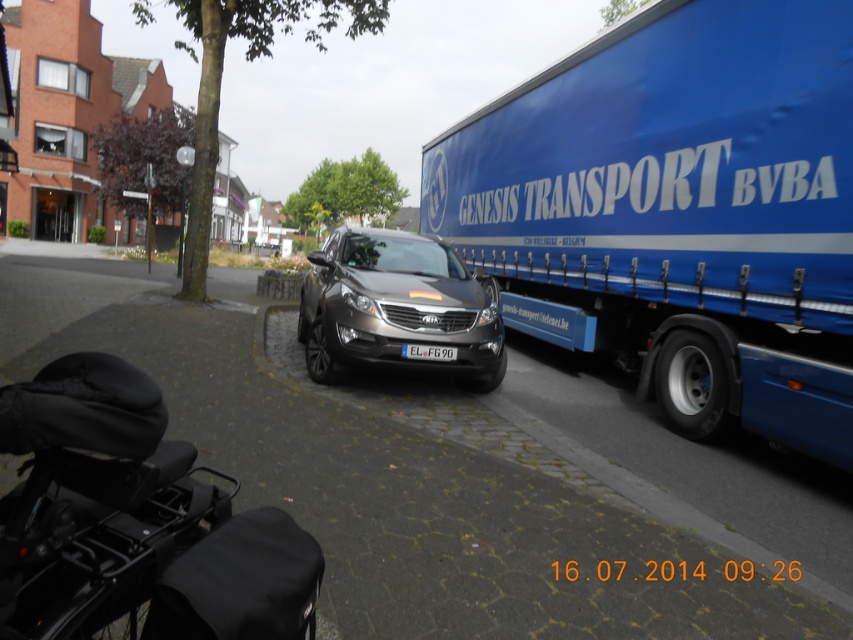
Is blue matte truck at right positioned in front of satin black car at center?

Yes, blue matte truck at right is closer to the viewer.

Image resolution: width=853 pixels, height=640 pixels. Identify the location of blue matte truck at right. (677, 211).

Does black matte motorcycle at lower left have a lesser height compared to satin black car at center?

Correct, black matte motorcycle at lower left is not as tall as satin black car at center.

Is black matte motorcycle at lower left wider than satin black car at center?

In fact, black matte motorcycle at lower left might be narrower than satin black car at center.

Which is in front, point (181, 540) or point (389, 232)?

Point (181, 540) is more forward.

Locate an element on the screen. The image size is (853, 640). black matte motorcycle at lower left is located at coordinates tap(134, 522).

Is point (489, 300) positioned in front of point (404, 349)?

No, it is behind (404, 349).

Between satin black car at center and white plastic license plate at center, which one has more height?

satin black car at center

Between point (380, 269) and point (444, 358), which one is positioned in front?

Positioned in front is point (444, 358).

Where is `satin black car at center`? The width and height of the screenshot is (853, 640). satin black car at center is located at coordinates (396, 307).